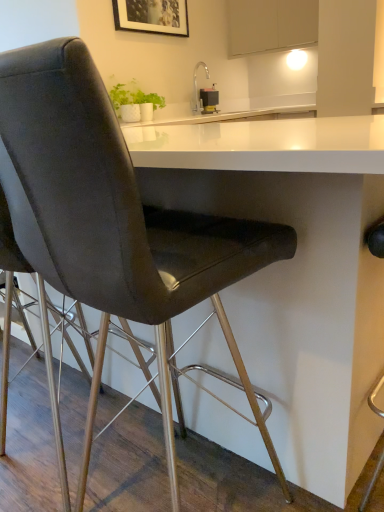
Question: From a real-world perspective, is satin nickel faucet at upper center positioned above or below metallic rectangular device at upper center?

Choices:
 (A) above
 (B) below

Answer: (A)

Question: From the image's perspective, is satin nickel faucet at upper center above or below metallic rectangular device at upper center?

Choices:
 (A) below
 (B) above

Answer: (A)

Question: Which object is the farthest from the metallic rectangular device at upper center?

Choices:
 (A) white matte cabinet at upper center
 (B) white glossy table at center
 (C) wooden picture frame at upper center
 (D) satin nickel faucet at upper center
 (E) matte black chair at left

Answer: (E)

Question: Which of these objects is positioned farthest from the matte black chair at left?

Choices:
 (A) metallic rectangular device at upper center
 (B) white glossy table at center
 (C) wooden picture frame at upper center
 (D) white matte cabinet at upper center
 (E) satin nickel faucet at upper center

Answer: (D)